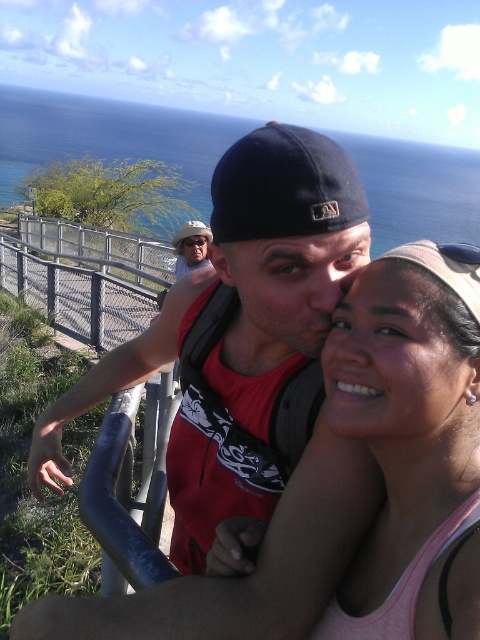
You are a photographer trying to capture the two people in the scene. Which person should you focus on first if you want to photograph the one wearing the matte red tank top at center before the pink fabric tank top at center?

The matte red tank top at center is positioned on the left side of the pink fabric tank top at center, so you should focus on the matte red tank top at center first as it is to the left.

You are a photographer trying to capture the scene of the two people at the overlook. You notice the matte red tank top at center and the matte black cap at upper center. Which object is wider in the image?

The matte red tank top at center is wider than the matte black cap at upper center.